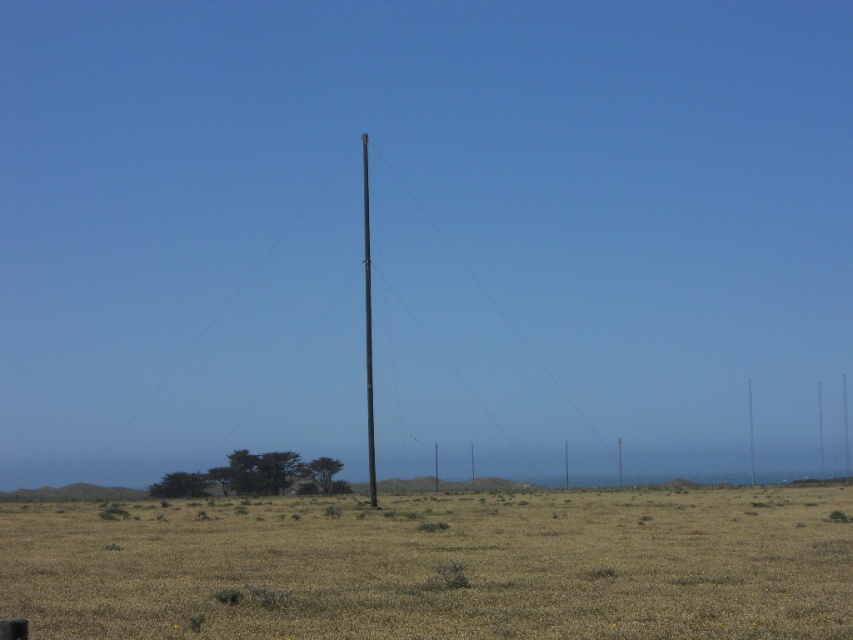
Question: Among these points, which one is farthest from the camera?

Choices:
 (A) (426, 548)
 (B) (473, 275)
 (C) (369, 422)

Answer: (B)

Question: Which object is positioned closest to the black smooth telegraph pole at center?

Choices:
 (A) black metallic pole at center
 (B) brown grassland at center

Answer: (B)

Question: Does brown grassland at center have a lesser width compared to black metallic pole at center?

Choices:
 (A) no
 (B) yes

Answer: (A)

Question: Among these objects, which one is farthest from the camera?

Choices:
 (A) black metallic pole at center
 (B) black smooth telegraph pole at center

Answer: (A)

Question: Is brown grassland at center further to the viewer compared to black smooth telegraph pole at center?

Choices:
 (A) yes
 (B) no

Answer: (B)

Question: Is black metallic pole at center positioned behind black smooth telegraph pole at center?

Choices:
 (A) no
 (B) yes

Answer: (B)